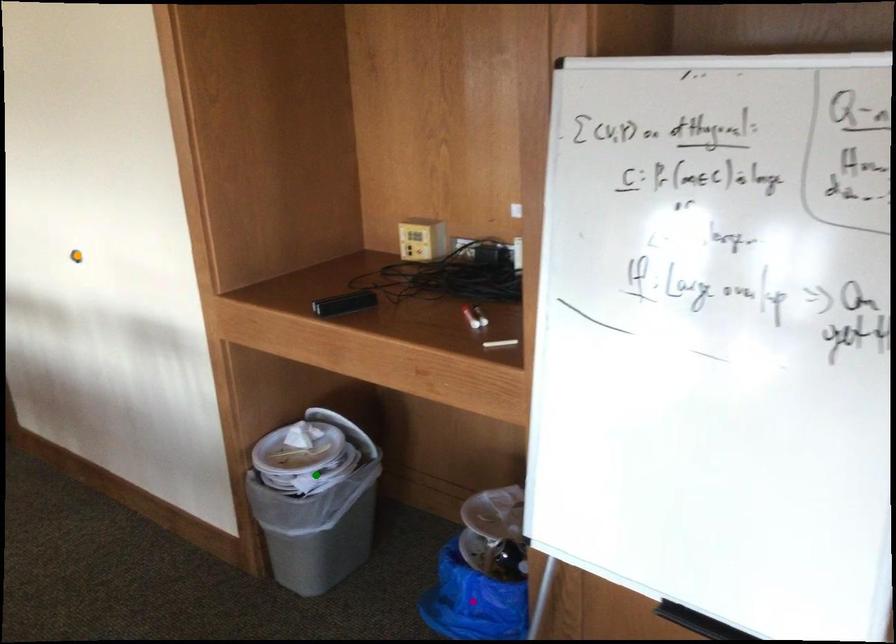
Order these from nearest to farthest:
orange point
purple point
green point

purple point < green point < orange point